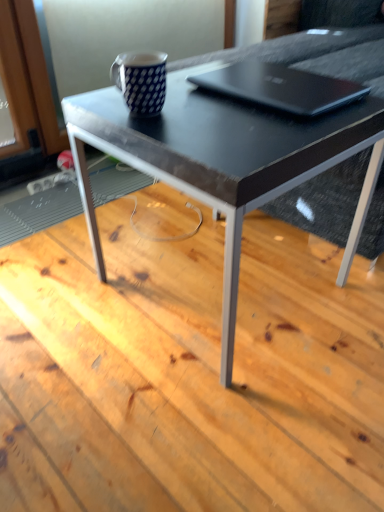
Locate an element on the screen. vacant area that is situated to the right of blue dotted mug at upper center is located at coordinates pos(213,111).